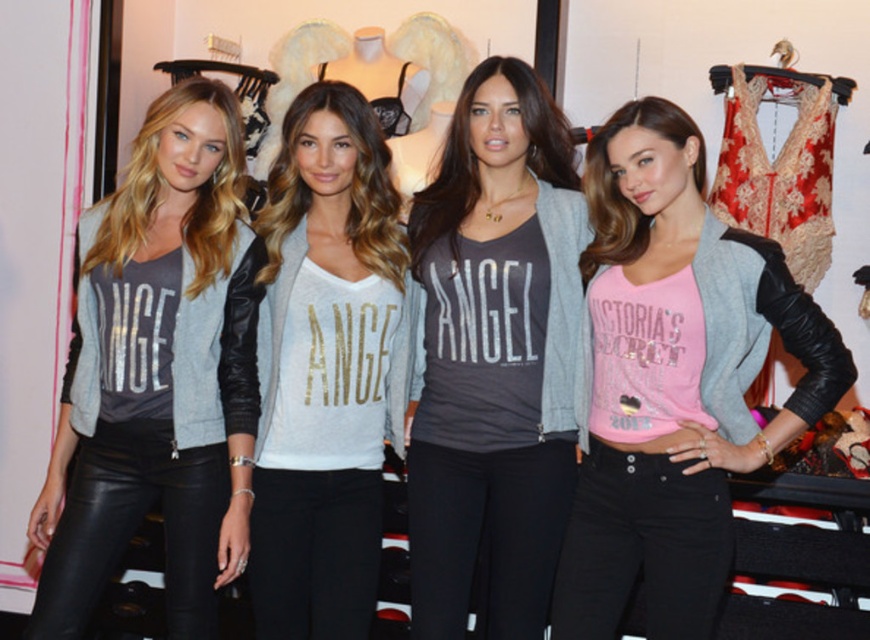
Is matte black leather pants at left behind silver metallic shirt at center?

No, matte black leather pants at left is in front of silver metallic shirt at center.

Based on the photo, between matte black leather pants at left and silver metallic shirt at center, which one appears on the right side from the viewer's perspective?

From the viewer's perspective, silver metallic shirt at center appears more on the right side.

Between point (161, 176) and point (379, 305), which one is positioned behind?

The point (379, 305) is behind.

You are a GUI agent. You are given a task and a screenshot of the screen. Output one action in this format:
    pyautogui.click(x=<x>, y=<y>)
    Task: Click on the matte black leather pants at left
    The width and height of the screenshot is (870, 640).
    Given the screenshot: What is the action you would take?
    pyautogui.click(x=157, y=374)

Can you confirm if pink matte jersey at center is shorter than matte gray cardigan at center?

Yes, pink matte jersey at center is shorter than matte gray cardigan at center.

Which is in front, point (599, 260) or point (503, 557)?

Point (599, 260) is in front.

Is point (614, 224) closer to viewer compared to point (573, 458)?

Yes, it is in front of point (573, 458).

In order to click on pink matte jersey at center in this screenshot , I will do `click(674, 380)`.

Does matte gray cardigan at center have a greater width compared to silver metallic shirt at center?

Yes.

Which is behind, point (500, 634) or point (305, 593)?

Point (305, 593)

The image size is (870, 640). What are the coordinates of `matte gray cardigan at center` in the screenshot? It's located at (x=494, y=356).